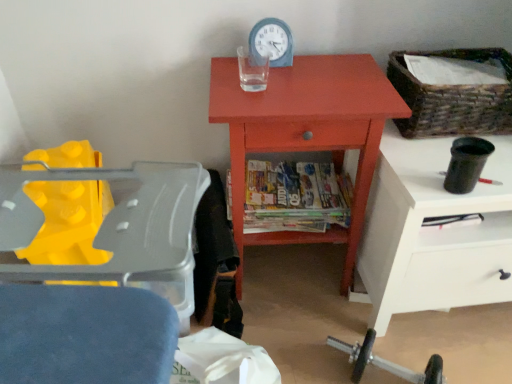
What do you see at coordinates (271, 43) in the screenshot? I see `blue plastic clock at upper center` at bounding box center [271, 43].

This screenshot has height=384, width=512. In order to click on matte orange cabinet at center in this screenshot , I will do `click(306, 132)`.

At what (x,y) coordinates should I click in order to perform the action: click on blue plastic clock at upper center. Please return your answer as a coordinate pair (x, y). Looking at the image, I should click on (271, 43).

Can white glossy nightstand at right be found inside woven brown basket at upper right?

No, woven brown basket at upper right does not contain white glossy nightstand at right.

Considering the sizes of objects woven brown basket at upper right and white glossy nightstand at right in the image provided, who is taller, woven brown basket at upper right or white glossy nightstand at right?

white glossy nightstand at right is taller.

Which is in front, woven brown basket at upper right or white glossy nightstand at right?

white glossy nightstand at right is closer to the camera.

Is woven brown basket at upper right facing towards white glossy nightstand at right?

No, woven brown basket at upper right is not oriented towards white glossy nightstand at right.

Which is nearer, (280, 111) or (263, 35)?

Clearly, point (280, 111) is closer to the camera than point (263, 35).

Does matte orange cabinet at center have a larger size compared to blue plastic clock at upper center?

Yes, matte orange cabinet at center is bigger than blue plastic clock at upper center.

From a real-world perspective, is matte orange cabinet at center above or below blue plastic clock at upper center?

A: matte orange cabinet at center is situated lower than blue plastic clock at upper center in the real world.

Based on the photo, is matte orange cabinet at center beside blue plastic clock at upper center?

There is a gap between matte orange cabinet at center and blue plastic clock at upper center.

From a real-world perspective, is multicolored glossy magazines at center physically located above or below woven brown basket at upper right?

Clearly, from a real-world perspective, multicolored glossy magazines at center is below woven brown basket at upper right.

Is multicolored glossy magazines at center shorter than woven brown basket at upper right?

Yes.

How different are the orientations of multicolored glossy magazines at center and woven brown basket at upper right in degrees?

The angular difference between multicolored glossy magazines at center and woven brown basket at upper right is 0.0642 degrees.

Is multicolored glossy magazines at center aimed at woven brown basket at upper right?

No, multicolored glossy magazines at center is not aimed at woven brown basket at upper right.

Which of these two, white glossy nightstand at right or multicolored glossy magazines at center, stands shorter?

multicolored glossy magazines at center is shorter.

In the scene shown: Considering the sizes of objects white glossy nightstand at right and multicolored glossy magazines at center in the image provided, who is bigger, white glossy nightstand at right or multicolored glossy magazines at center?

white glossy nightstand at right.

In the scene shown: From a real-world perspective, between white glossy nightstand at right and multicolored glossy magazines at center, who is vertically lower?

white glossy nightstand at right is physically lower.

Measure the distance from multicolored glossy magazines at center to matte orange cabinet at center.

multicolored glossy magazines at center is 7.36 inches away from matte orange cabinet at center.

Does multicolored glossy magazines at center have a greater height compared to matte orange cabinet at center?

In fact, multicolored glossy magazines at center may be shorter than matte orange cabinet at center.

From a real-world perspective, is multicolored glossy magazines at center located higher than matte orange cabinet at center?

No, from a real-world perspective, multicolored glossy magazines at center is not above matte orange cabinet at center.

Would you say multicolored glossy magazines at center is to the left or to the right of matte orange cabinet at center in the picture?

From the image, it's evident that multicolored glossy magazines at center is to the left of matte orange cabinet at center.

Between blue plastic clock at upper center and multicolored glossy magazines at center, which one appears on the right side from the viewer's perspective?

From the viewer's perspective, multicolored glossy magazines at center appears more on the right side.

From a real-world perspective, is blue plastic clock at upper center physically above multicolored glossy magazines at center?

Indeed, from a real-world perspective, blue plastic clock at upper center stands above multicolored glossy magazines at center.

Could you tell me if blue plastic clock at upper center is facing multicolored glossy magazines at center?

No, blue plastic clock at upper center does not turn towards multicolored glossy magazines at center.

Who is smaller, blue plastic clock at upper center or multicolored glossy magazines at center?

With smaller size is blue plastic clock at upper center.

From the image's perspective, between white glossy nightstand at right and matte orange cabinet at center, who is located below?

white glossy nightstand at right appears lower in the image.

Can you confirm if white glossy nightstand at right is taller than matte orange cabinet at center?

Incorrect, the height of white glossy nightstand at right is not larger of that of matte orange cabinet at center.

Is white glossy nightstand at right smaller than matte orange cabinet at center?

No, white glossy nightstand at right is not smaller than matte orange cabinet at center.

Is white glossy nightstand at right positioned with its back to matte orange cabinet at center?

white glossy nightstand at right does not have its back to matte orange cabinet at center.

The width and height of the screenshot is (512, 384). I want to click on nightstand located in front of the woven brown basket at upper right, so click(x=433, y=232).

Find the location of a particular element. clock above the matte orange cabinet at center (from the image's perspective) is located at coordinates (271, 43).

Which object lies nearer to the anchor point woven brown basket at upper right, multicolored glossy magazines at center or white glossy nightstand at right?

The object closer to woven brown basket at upper right is white glossy nightstand at right.

Looking at the image, which one is located closer to multicolored glossy magazines at center, blue plastic clock at upper center or matte orange cabinet at center?

Among the two, matte orange cabinet at center is located nearer to multicolored glossy magazines at center.

Which object lies further to the anchor point multicolored glossy magazines at center, matte orange cabinet at center or white glossy nightstand at right?

Based on the image, white glossy nightstand at right appears to be further to multicolored glossy magazines at center.

Estimate the real-world distances between objects in this image. Which object is further from matte orange cabinet at center, white glossy nightstand at right or blue plastic clock at upper center?

The object further to matte orange cabinet at center is blue plastic clock at upper center.

Looking at the image, which one is located further to white glossy nightstand at right, blue plastic clock at upper center or multicolored glossy magazines at center?

blue plastic clock at upper center.

When comparing their distances from multicolored glossy magazines at center, does woven brown basket at upper right or matte orange cabinet at center seem further?

The object further to multicolored glossy magazines at center is woven brown basket at upper right.

Estimate the real-world distances between objects in this image. Which object is closer to woven brown basket at upper right, blue plastic clock at upper center or white glossy nightstand at right?

white glossy nightstand at right is positioned closer to the anchor woven brown basket at upper right.

Based on their spatial positions, is woven brown basket at upper right or white glossy nightstand at right further from blue plastic clock at upper center?

Among the two, white glossy nightstand at right is located further to blue plastic clock at upper center.

Identify the location of the chest of drawers located between blue plastic clock at upper center and woven brown basket at upper right in the left-right direction. This screenshot has height=384, width=512. (306, 132).

Find the location of `magazine between blue plastic clock at upper center and woven brown basket at upper right from left to right`. magazine between blue plastic clock at upper center and woven brown basket at upper right from left to right is located at coordinates point(293,197).

Find the location of `magazine situated between blue plastic clock at upper center and white glossy nightstand at right from left to right`. magazine situated between blue plastic clock at upper center and white glossy nightstand at right from left to right is located at coordinates (293, 197).

What are the coordinates of `chest of drawers between multicolored glossy magazines at center and woven brown basket at upper right from left to right` in the screenshot? It's located at (306, 132).